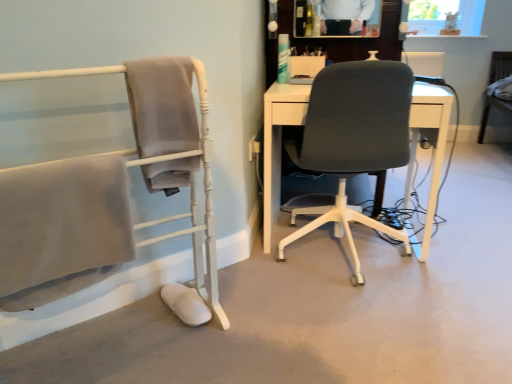
Question: Based on their sizes in the image, would you say matte gray chair at left, which is the first chair in left-to-right order, is bigger or smaller than dark gray fabric office chair at center, which is the second chair in back-to-front order?

Choices:
 (A) big
 (B) small

Answer: (B)

Question: Relative to dark gray fabric office chair at center, which is the second chair in back-to-front order, is matte gray chair at left, which is the first chair in left-to-right order, in front or behind?

Choices:
 (A) behind
 (B) front

Answer: (B)

Question: Estimate the real-world distances between objects in this image. Which object is farther from the matte gray chair at left, which is the first chair in left-to-right order?

Choices:
 (A) wooden chair at right, marked as the third chair in a left-to-right arrangement
 (B) dark gray fabric office chair at center, which is the second chair in front-to-back order

Answer: (A)

Question: Considering the real-world distances, which object is closest to the dark gray fabric office chair at center, arranged as the 2th chair when viewed from the left?

Choices:
 (A) matte gray chair at left, which is the first chair in left-to-right order
 (B) wooden chair at right, the third chair when ordered from front to back

Answer: (A)